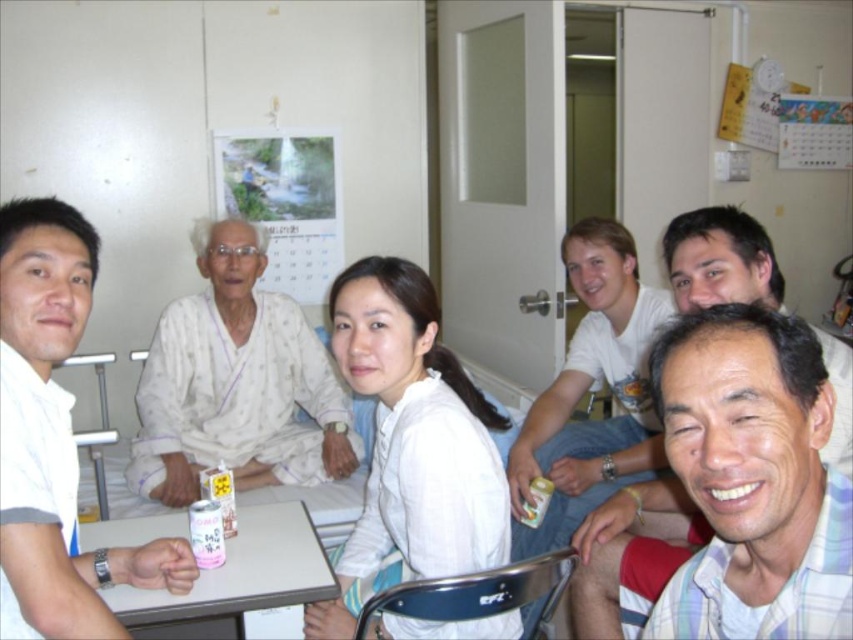
Does white matte shirt at left have a lesser width compared to white plastic table at lower center?

Yes.

Between white matte shirt at left and white plastic table at lower center, which one appears on the left side from the viewer's perspective?

white matte shirt at left is more to the left.

Is point (48, 552) behind point (251, 592)?

No, it is in front of (251, 592).

I want to click on white matte shirt at left, so click(x=54, y=438).

Who is shorter, white cotton pajamas at center or light brown wood chair at center?

white cotton pajamas at center

Which is more to the left, white cotton pajamas at center or light brown wood chair at center?

From the viewer's perspective, white cotton pajamas at center appears more on the left side.

The image size is (853, 640). In order to click on white cotton pajamas at center in this screenshot , I will do `click(236, 384)`.

Between point (647, 486) and point (131, 589), which one is positioned in front?

Point (131, 589)

Between plaid cotton shirt at center and white plastic table at lower center, which one is positioned higher?

Positioned higher is plaid cotton shirt at center.

This screenshot has width=853, height=640. Identify the location of plaid cotton shirt at center. (631, 552).